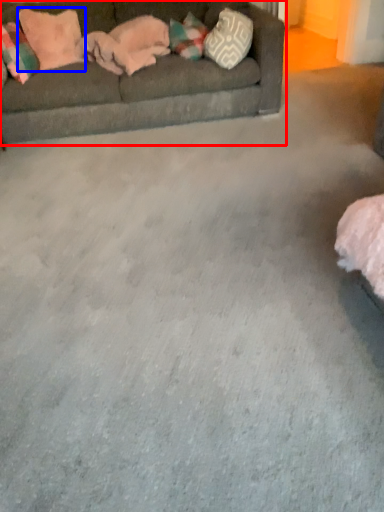
Question: Which object is closer to the camera taking this photo, studio couch (highlighted by a red box) or pillow (highlighted by a blue box)?

Choices:
 (A) studio couch
 (B) pillow

Answer: (A)